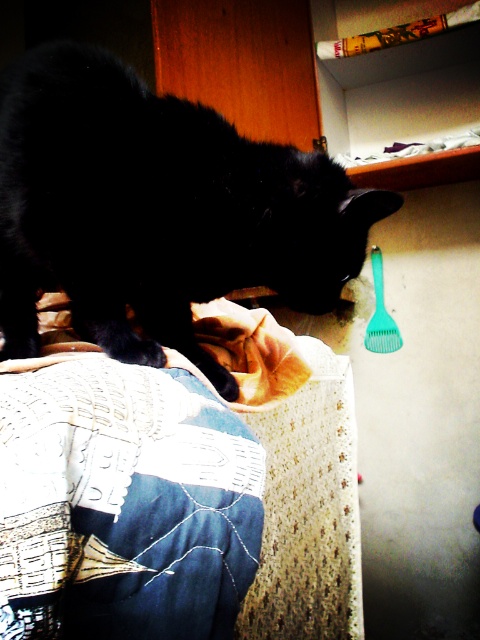
Is embroidered denim jeans at lower left positioned before green plastic brush at upper right?

Yes, it is.

Who is taller, embroidered denim jeans at lower left or green plastic brush at upper right?

green plastic brush at upper right

Who is more distant from viewer, (69, 403) or (383, 282)?

The point (383, 282) is behind.

The width and height of the screenshot is (480, 640). Find the location of `embroidered denim jeans at lower left`. embroidered denim jeans at lower left is located at coordinates (123, 504).

Measure the distance between black fur cat at left and embroidered denim jeans at lower left.

A distance of 9.46 inches exists between black fur cat at left and embroidered denim jeans at lower left.

Is black fur cat at left positioned in front of embroidered denim jeans at lower left?

No, it is behind embroidered denim jeans at lower left.

Measure the distance between point (320, 225) and camera.

A distance of 87.69 centimeters exists between point (320, 225) and camera.

Find the location of `black fur cat at left`. black fur cat at left is located at coordinates (156, 211).

Is black fur cat at left further to the viewer compared to green plastic brush at upper right?

No.

Image resolution: width=480 pixels, height=640 pixels. What do you see at coordinates (156, 211) in the screenshot?
I see `black fur cat at left` at bounding box center [156, 211].

Where is `black fur cat at left`? black fur cat at left is located at coordinates (156, 211).